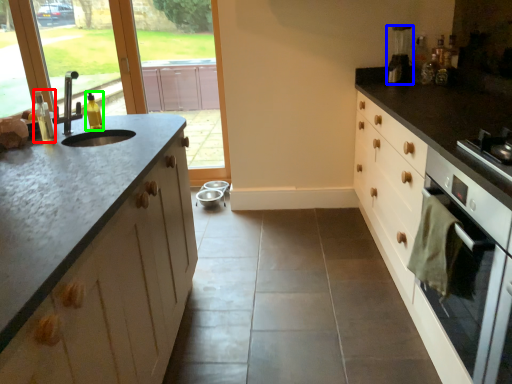
Question: Which object is positioned closest to bottle (highlighted by a red box)? Select from coffee machine (highlighted by a blue box) and bottle (highlighted by a green box).

Choices:
 (A) coffee machine
 (B) bottle

Answer: (B)